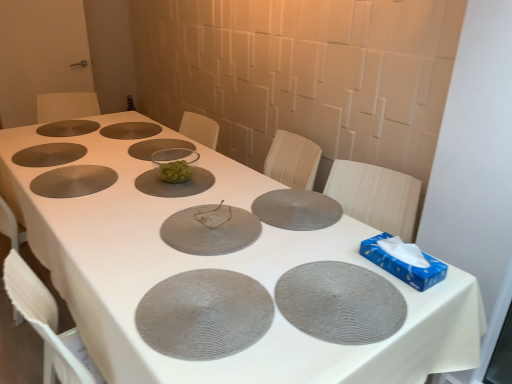
At what (x,y) coordinates should I click in order to perform the action: click on unoccupied area behind green glass bowl at center. Please return your answer as a coordinate pair (x, y). The height and width of the screenshot is (384, 512). Looking at the image, I should click on (189, 158).